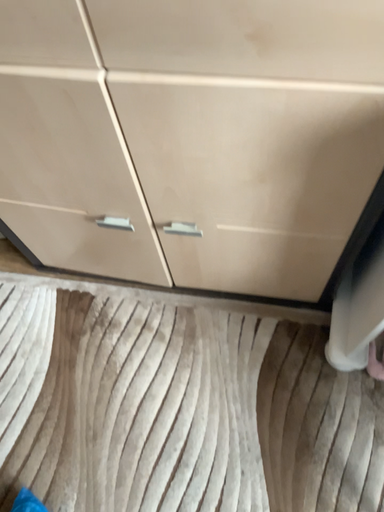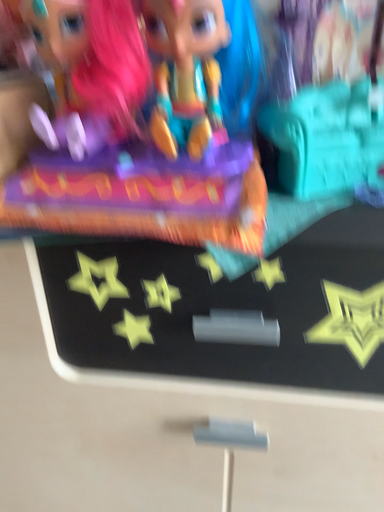
Question: Which way did the camera rotate in the video?

Choices:
 (A) rotated upward
 (B) rotated downward

Answer: (A)